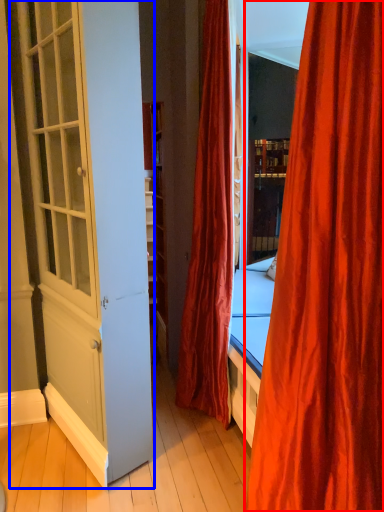
Question: Which point is further to the camera, curtain (highlighted by a red box) or screen door (highlighted by a blue box)?

Choices:
 (A) curtain
 (B) screen door

Answer: (B)